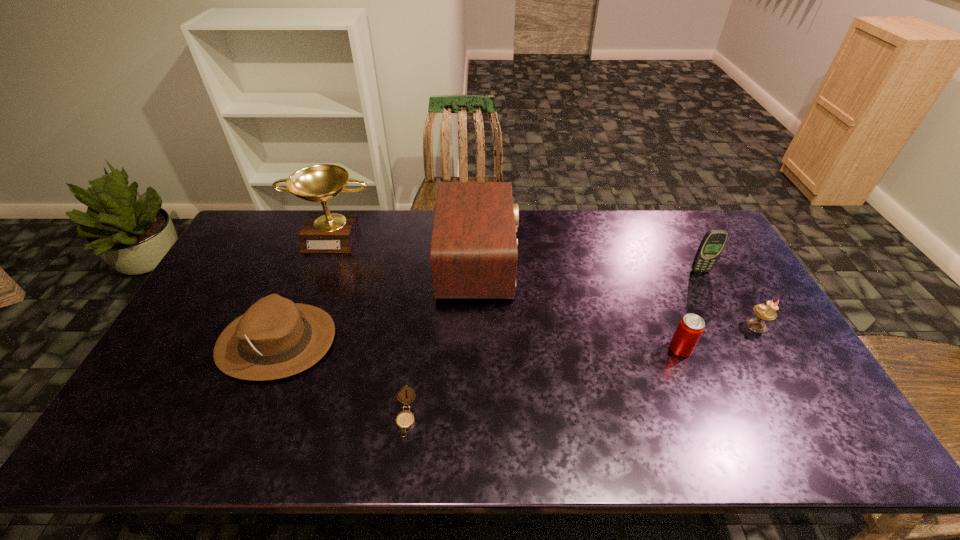
This screenshot has height=540, width=960. Identify the location of award. (323, 232).

The image size is (960, 540). Identify the location of radio receiver. (473, 254).

At what (x,y) coordinates should I click in order to perform the action: click on the sixth object from left to right. Please return your answer as a coordinate pair (x, y). Image resolution: width=960 pixels, height=540 pixels. Looking at the image, I should click on (714, 241).

In order to click on fedora in this screenshot , I will do `click(275, 338)`.

You are a GUI agent. You are given a task and a screenshot of the screen. Output one action in this format:
    pyautogui.click(x=<x>, y=<y>)
    Task: Click on the rightmost object
    This screenshot has width=960, height=540.
    Given the screenshot: What is the action you would take?
    pyautogui.click(x=767, y=312)

Locate an element on the screen. The height and width of the screenshot is (540, 960). can is located at coordinates (690, 328).

Find the location of `the nearest object`. the nearest object is located at coordinates (405, 419).

Where is `compass`? This screenshot has width=960, height=540. compass is located at coordinates (405, 419).

Where is `vacant space located on the front-facing side of the award`? This screenshot has height=540, width=960. vacant space located on the front-facing side of the award is located at coordinates (317, 278).

Where is `free space located 0.350m on the front panel of the radio receiver`? The image size is (960, 540). free space located 0.350m on the front panel of the radio receiver is located at coordinates (622, 263).